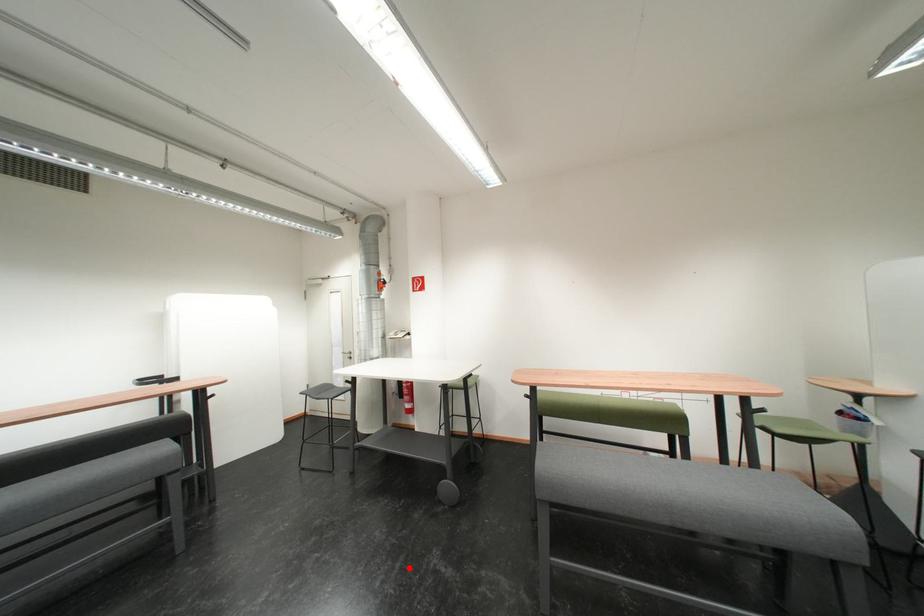
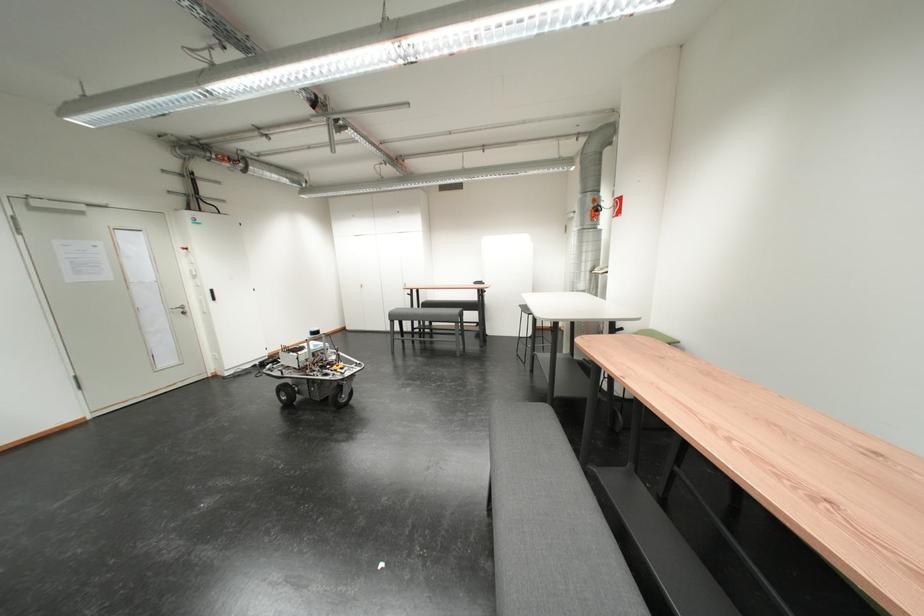
Question: I am providing you with two images of the same scene from different viewpoints. A red point is shown in image1. For the corresponding object point in image2, is it positioned nearer or farther from the camera?

Choices:
 (A) Nearer
 (B) Farther

Answer: (A)